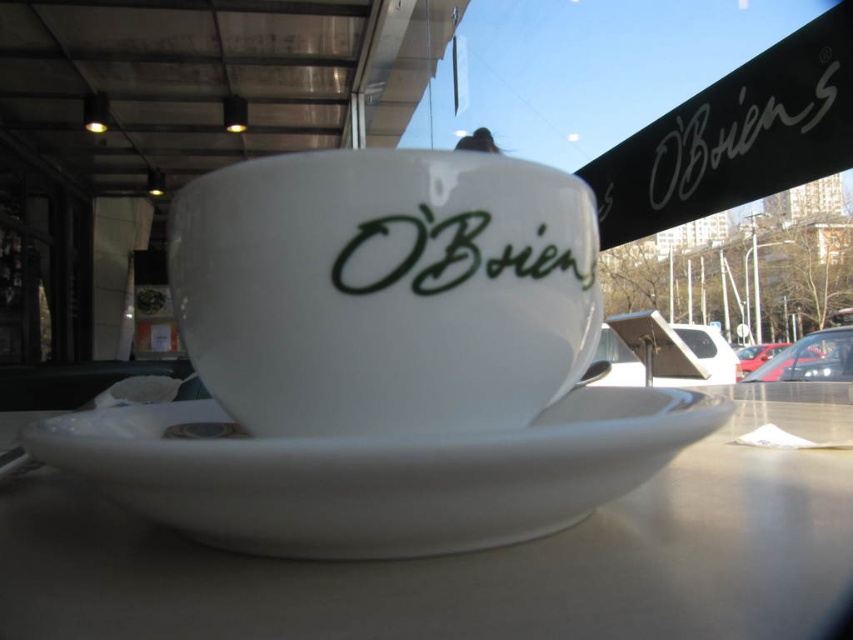
Question: Based on their relative distances, which object is farther from the white porcelain cup at center?

Choices:
 (A) green matte text at center
 (B) white matte signboard at upper center
 (C) white glossy saucer at center

Answer: (B)

Question: Does white glossy saucer at center have a larger size compared to white matte signboard at upper center?

Choices:
 (A) yes
 (B) no

Answer: (B)

Question: Which point is farther to the camera?

Choices:
 (A) white matte signboard at upper center
 (B) white glossy saucer at center

Answer: (A)

Question: Can you confirm if white glossy saucer at center is positioned to the left of white matte signboard at upper center?

Choices:
 (A) no
 (B) yes

Answer: (B)

Question: Which point is farther to the camera?

Choices:
 (A) white matte signboard at upper center
 (B) white porcelain cup at center
 (C) green matte text at center

Answer: (A)

Question: Is the position of white porcelain cup at center more distant than that of white matte signboard at upper center?

Choices:
 (A) yes
 (B) no

Answer: (B)